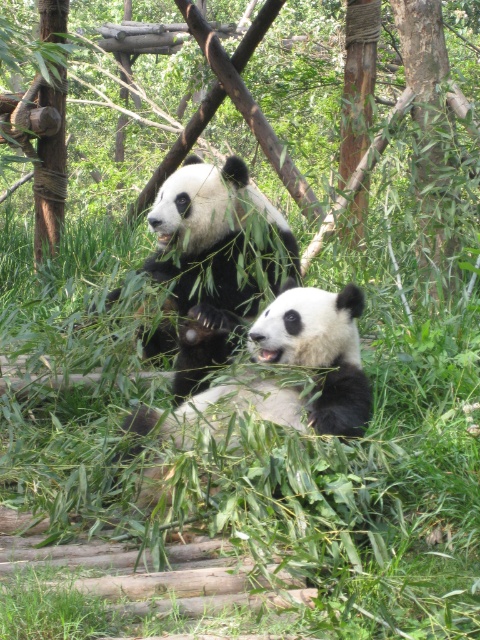
Looking at this image, does green leafy tree at upper center appear over black fuzzy panda at upper center?

Indeed, green leafy tree at upper center is positioned over black fuzzy panda at upper center.

Does green leafy tree at upper center have a greater width compared to black fuzzy panda at upper center?

Indeed, green leafy tree at upper center has a greater width compared to black fuzzy panda at upper center.

Does point (436, 109) lie behind point (269, 218)?

Yes, point (436, 109) is behind point (269, 218).

I want to click on green leafy tree at upper center, so click(434, 141).

Is black fuzzy panda at upper center smaller than black fuzzy panda at center?

Incorrect, black fuzzy panda at upper center is not smaller in size than black fuzzy panda at center.

Between point (276, 212) and point (327, 403), which one is positioned in front?

Point (327, 403) is in front.

The image size is (480, 640). I want to click on black fuzzy panda at upper center, so click(206, 264).

Is green leafy tree at upper center shorter than black fuzzy panda at center?

In fact, green leafy tree at upper center may be taller than black fuzzy panda at center.

Measure the distance between point (425, 144) and camera.

Point (425, 144) is 18.30 feet from camera.

Identify the location of green leafy tree at upper center. The width and height of the screenshot is (480, 640). (434, 141).